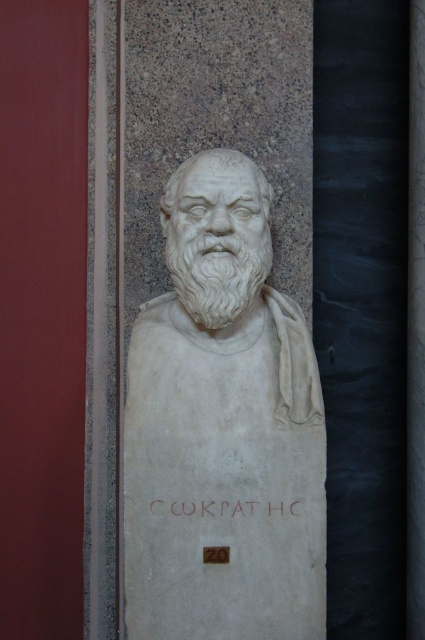
Is white marble bust at center further to the viewer compared to white stone inscription at center?

No.

Does white marble bust at center have a lesser width compared to white stone inscription at center?

No, white marble bust at center is not thinner than white stone inscription at center.

Which is in front, point (305, 632) or point (286, 508)?

Positioned in front is point (305, 632).

Locate an element on the screen. Image resolution: width=425 pixels, height=640 pixels. white marble bust at center is located at coordinates (223, 426).